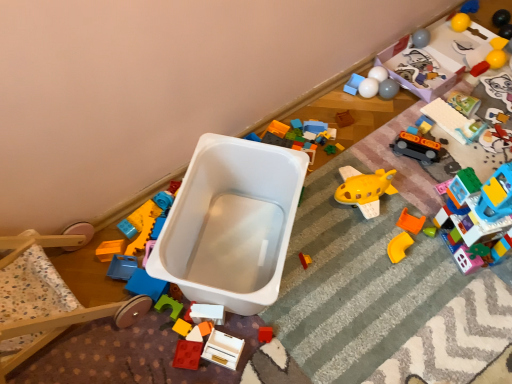
The height and width of the screenshot is (384, 512). I want to click on free space that is in between rubberized plastic block at center, the 1th toy positioned from the left, and orange plastic block at lower right, placed as the 10th toy when sorted from left to right, so click(335, 258).